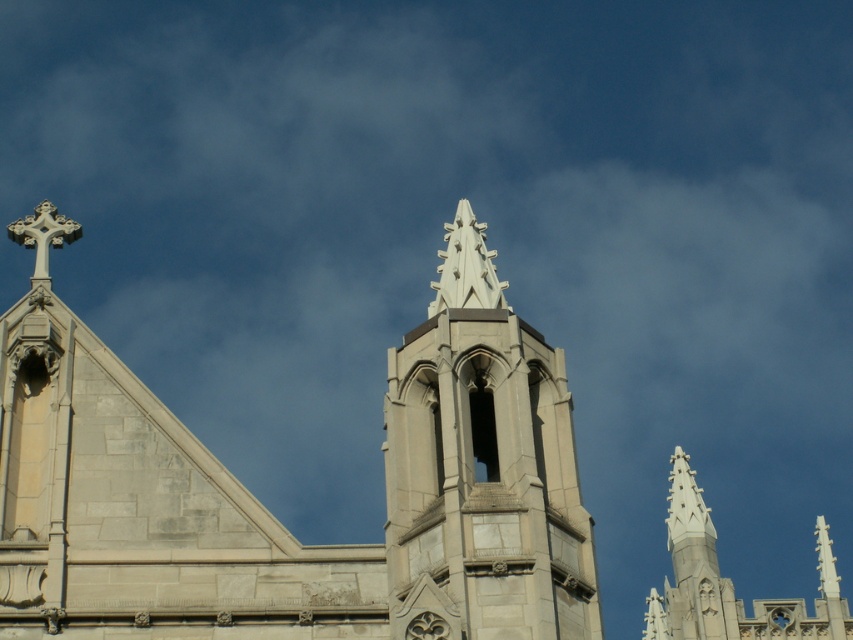
You are an architect examining the Gothic building. You notice the gray stone church steeple at center and the white stone tower at center. Which one is positioned lower in the image?

The gray stone church steeple at center is positioned lower because it is below the white stone tower at center.

In the scene shown: You are a photographer planning to capture the gray stone church steeple at center and the white stone tower at center in a single frame. Based on their heights, which one will appear taller in the photograph?

The gray stone church steeple at center will appear taller in the photograph because it has a greater height compared to the white stone tower at center.

Based on the photo, you are standing in front of the Gothic building and want to take a photo of both the gray stone church steeple at center and the white stone tower at center. Which object should you focus on first to ensure both are in frame?

You should focus on the gray stone church steeple at center first because it is closer to you than the white stone tower at center, ensuring both remain in the frame by starting with the closer object.